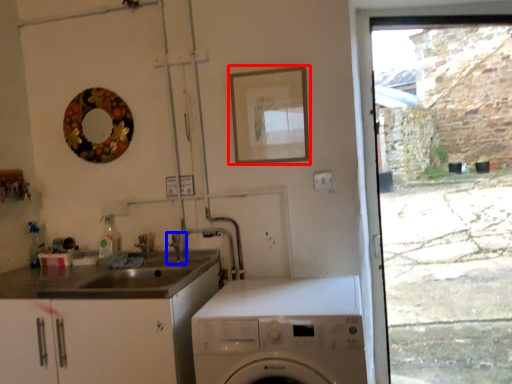
Question: Which point is further to the camera, picture frame (highlighted by a red box) or tap (highlighted by a blue box)?

Choices:
 (A) picture frame
 (B) tap

Answer: (B)